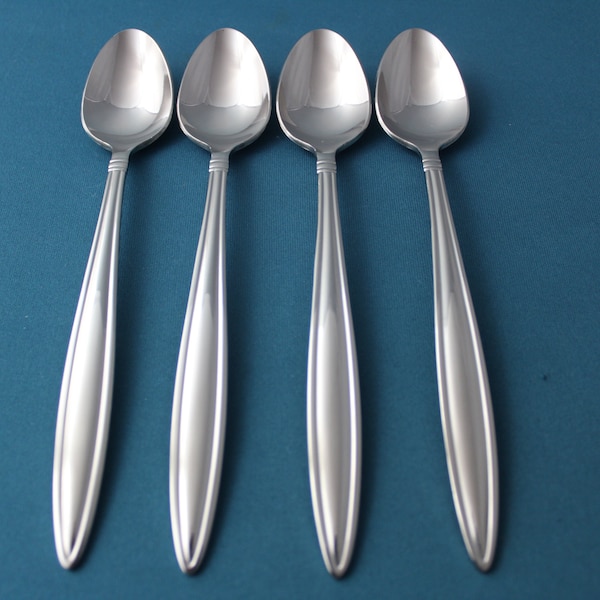
The width and height of the screenshot is (600, 600). Find the location of `spoons`. spoons is located at coordinates point(124,118), point(211,113), point(438,120), point(337,128).